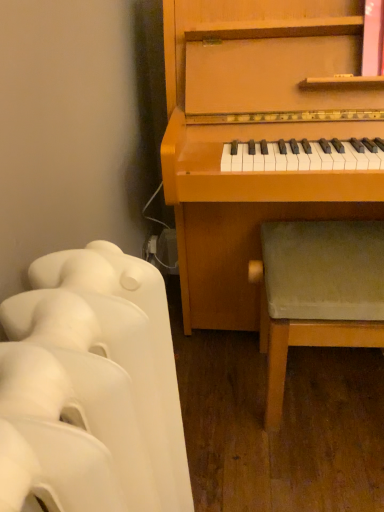
Locate an element on the screen. This screenshot has width=384, height=512. blank space situated above white matte radiator at lower left (from a real-world perspective) is located at coordinates (60, 320).